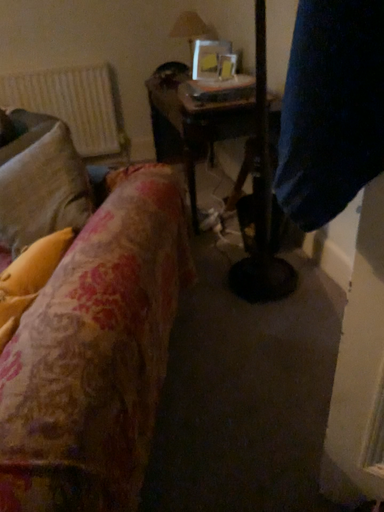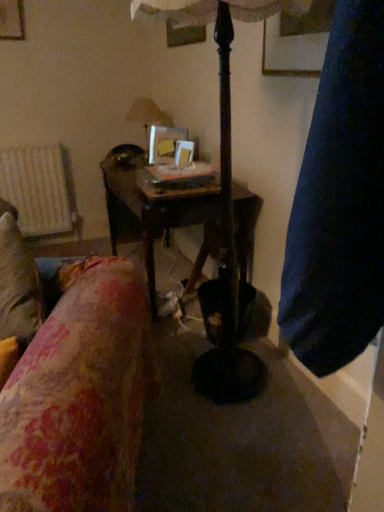
Question: Which way did the camera rotate in the video?

Choices:
 (A) rotated left
 (B) rotated right

Answer: (B)